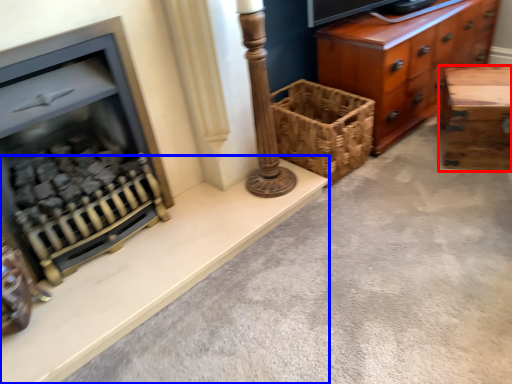
Question: Which of the following is the farthest to the observer, table (highlighted by a red box) or ledge (highlighted by a blue box)?

Choices:
 (A) table
 (B) ledge

Answer: (A)